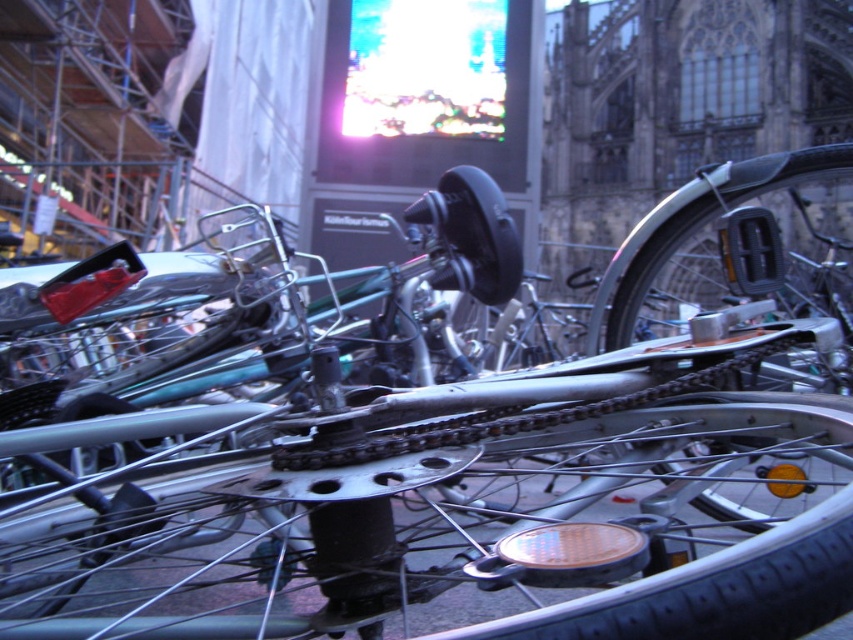
You are a mechanic inspecting a bicycle. You notice the silver metallic bicycle wheel at center and the shiny metallic chainring at center. Which object is shorter in height?

The silver metallic bicycle wheel at center is not as tall as the shiny metallic chainring at center, so the silver metallic bicycle wheel at center is shorter in height.

Based on the photo, you are standing in front of a large screen that is part of a construction site. You want to know if you can safely walk towards the point marked at coordinate (660, 419) without getting too close to the construction area. The safe distance is set at 50 meters. Can you walk towards that point?

The point at coordinate (660, 419) is 60.57 meters away from you. Since the safe distance is 50 meters, you can walk towards that point as you are still within the safe range.